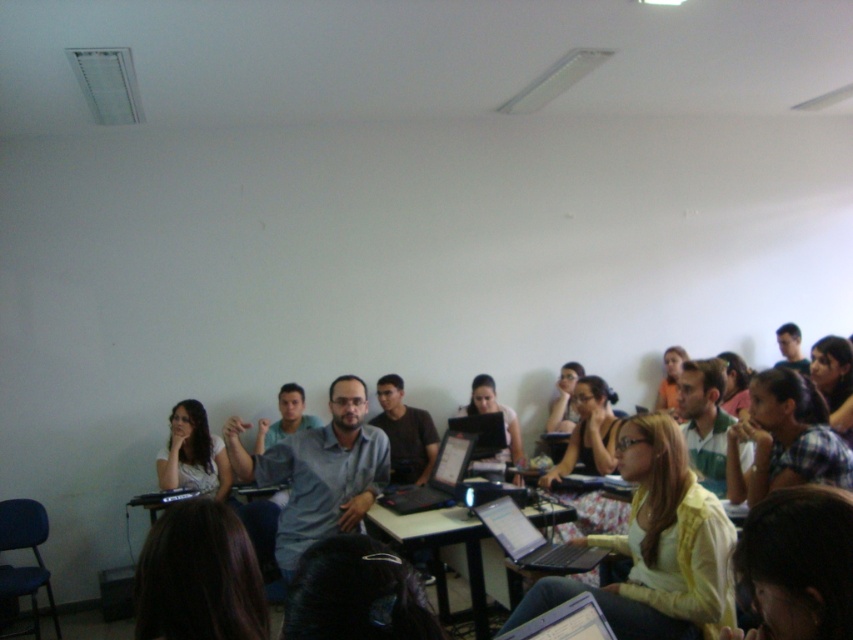
You are a student sitting at the desk with both the silver metallic laptop at center and the black glossy laptop at center in front of you. Which laptop is closer to you?

The silver metallic laptop at center is closer to you because it is positioned in front of the black glossy laptop at center.

You are organizing a classroom activity and need to place a 1.2 meter wide poster on the black plastic table at center. Can the poster fit on the table if the silver metallic laptop at center is already placed there?

The black plastic table at center is bigger than the silver metallic laptop at center, so the poster might fit depending on the table size. However, since the laptop is already on the table, ensure there is enough space around it for the poster.

You are a student sitting at the back of the classroom and want to hand in an assignment to the teacher at the front. You notice the matte yellow sweater at center and the black plastic table at center. Which object is closer to you?

The matte yellow sweater at center is closer to the viewer than the black plastic table at center, so the sweater is closer to you.